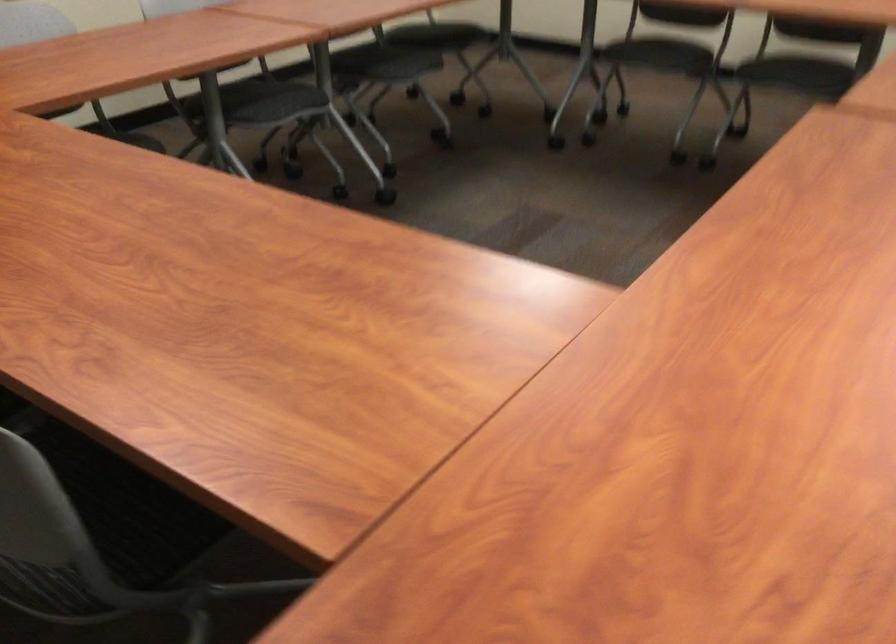
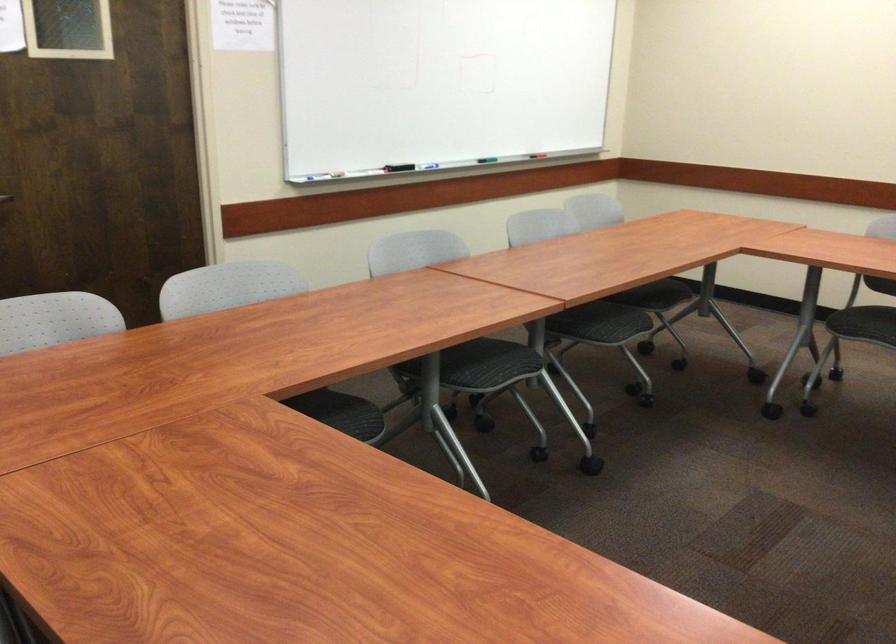
In the second image, find the point that corresponds to (x=392, y=68) in the first image.

(583, 315)